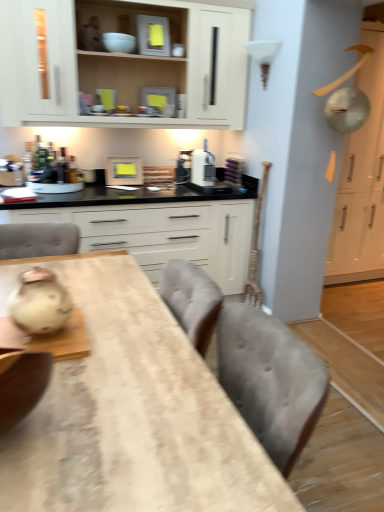
The width and height of the screenshot is (384, 512). I want to click on vacant space behind matte white ceramic tea pot at left, so click(94, 303).